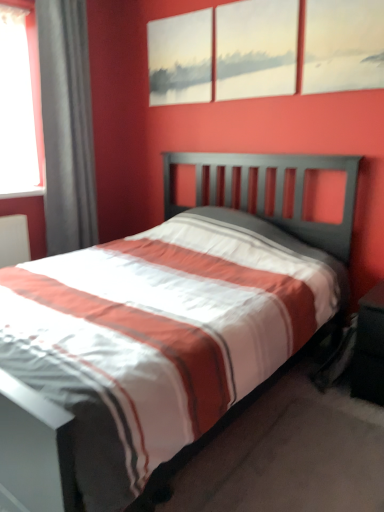
Question: Is matte canvas painting at upper center, the first picture frame in the right-to-left sequence, oriented away from matte white canvas at upper center, the 2th picture frame positioned from the left?

Choices:
 (A) no
 (B) yes

Answer: (A)

Question: Is matte white canvas at upper center, the 2th picture frame positioned from the left, surrounded by matte canvas painting at upper center, the first picture frame in the right-to-left sequence?

Choices:
 (A) no
 (B) yes

Answer: (A)

Question: Is matte canvas painting at upper center, the first picture frame in the right-to-left sequence, facing towards matte white canvas at upper center, the 2th picture frame positioned from the left?

Choices:
 (A) yes
 (B) no

Answer: (B)

Question: Is matte canvas painting at upper center, arranged as the 3th picture frame when viewed from the left, further to camera compared to matte white canvas at upper center, the second picture frame positioned from the right?

Choices:
 (A) yes
 (B) no

Answer: (B)

Question: Does matte canvas painting at upper center, arranged as the 3th picture frame when viewed from the left, have a larger size compared to matte white canvas at upper center, the 2th picture frame positioned from the left?

Choices:
 (A) yes
 (B) no

Answer: (B)

Question: Would you say matte canvas painting at upper center, the first picture frame in the right-to-left sequence, is a long distance from matte white canvas at upper center, the 2th picture frame positioned from the left?

Choices:
 (A) no
 (B) yes

Answer: (A)

Question: Considering the relative positions of gray fabric curtain at left and black matte nightstand at lower right in the image provided, is gray fabric curtain at left to the right of black matte nightstand at lower right from the viewer's perspective?

Choices:
 (A) yes
 (B) no

Answer: (B)

Question: Is gray fabric curtain at left with black matte nightstand at lower right?

Choices:
 (A) no
 (B) yes

Answer: (A)

Question: Is gray fabric curtain at left oriented towards black matte nightstand at lower right?

Choices:
 (A) yes
 (B) no

Answer: (A)

Question: Does gray fabric curtain at left contain black matte nightstand at lower right?

Choices:
 (A) no
 (B) yes

Answer: (A)

Question: Would you say gray fabric curtain at left is a long distance from black matte nightstand at lower right?

Choices:
 (A) no
 (B) yes

Answer: (B)

Question: Can you confirm if gray fabric curtain at left is positioned to the left of black matte nightstand at lower right?

Choices:
 (A) no
 (B) yes

Answer: (B)

Question: Are matte gray painting at upper center, positioned as the 1th picture frame in left-to-right order, and matte canvas painting at upper center, arranged as the 3th picture frame when viewed from the left, beside each other?

Choices:
 (A) no
 (B) yes

Answer: (A)